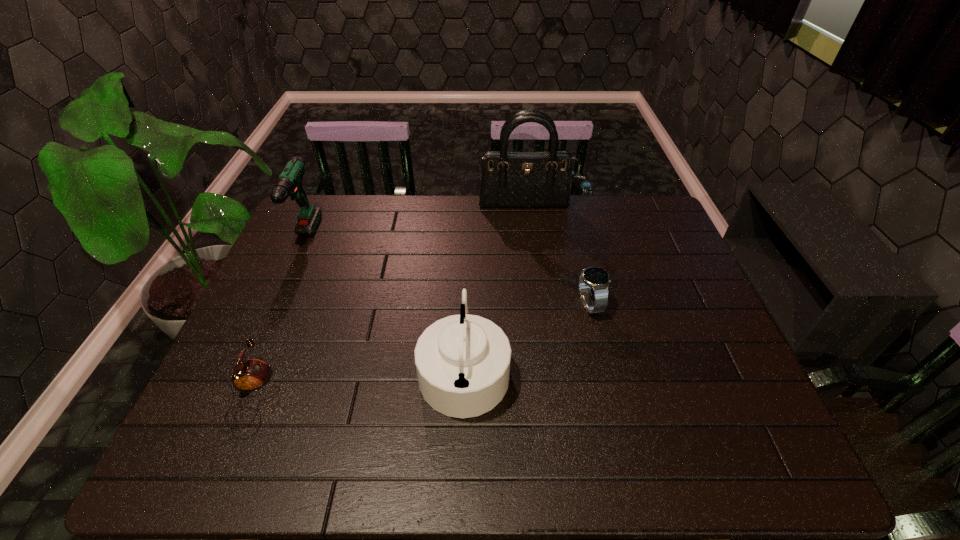
The height and width of the screenshot is (540, 960). In order to click on the farthest object in this screenshot , I will do `click(509, 179)`.

At what (x,y) coordinates should I click in order to perform the action: click on handbag. Please return your answer as a coordinate pair (x, y). This screenshot has width=960, height=540. Looking at the image, I should click on (509, 179).

Image resolution: width=960 pixels, height=540 pixels. Identify the location of the second farthest object. (289, 183).

Identify the location of the fourth shortest object. The width and height of the screenshot is (960, 540). (289, 183).

Locate an element on the screen. kettle is located at coordinates (462, 361).

Locate an element on the screen. This screenshot has height=540, width=960. the third nearest object is located at coordinates (595, 278).

Image resolution: width=960 pixels, height=540 pixels. Identify the location of watch. (595, 278).

At what (x,y) coordinates should I click in order to perform the action: click on telephone. Please return your answer as a coordinate pair (x, y). Looking at the image, I should click on (251, 375).

At what (x,y) coordinates should I click in order to perform the action: click on vacant area situated with an open clasp on the front of the farthest object. Please return your answer as a coordinate pair (x, y). This screenshot has height=540, width=960. Looking at the image, I should click on (535, 275).

Identify the location of vacant area situated 0.250m on the handle side of the drill. Image resolution: width=960 pixels, height=540 pixels. (260, 336).